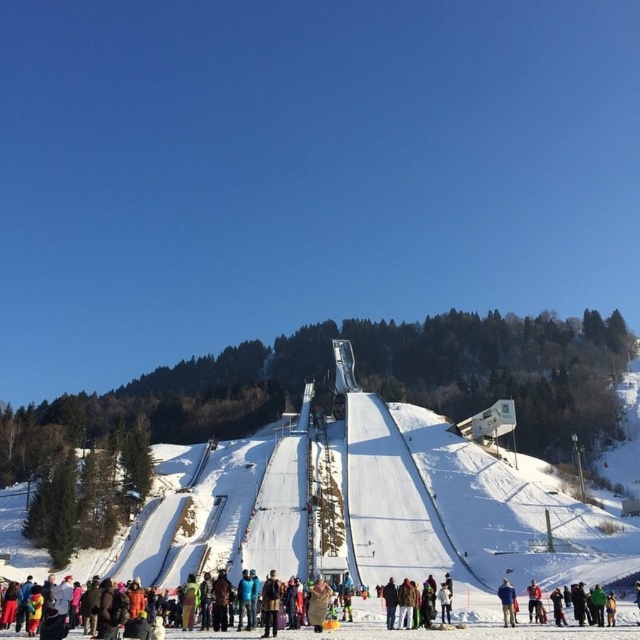
You are a photographer standing at the edge of the ski jump ramp. You want to capture a photo of the white snowboarder at center and the red wool sweater at center in the same frame. Which object should you focus on first if you want to ensure both are in focus?

The white snowboarder at center is wider than the red wool sweater at center, so you should focus on the white snowboarder at center first to ensure both are in focus.

Based on the photo, you are a photographer trying to capture both the brown wool coat at center and the blue woolen sweater at center in a single shot. Which clothing item appears smaller in the photo?

The brown wool coat at center appears smaller in the photo compared to the blue woolen sweater at center.

You are a photographer at the ski event. You want to take a photo of the white snowboarder at center and the red wool sweater at center. Which object should you focus on first to ensure both are in focus?

You should focus on the white snowboarder at center first because it is closer to the viewer than the red wool sweater at center, so adjusting focus from near to far will help both be in focus.